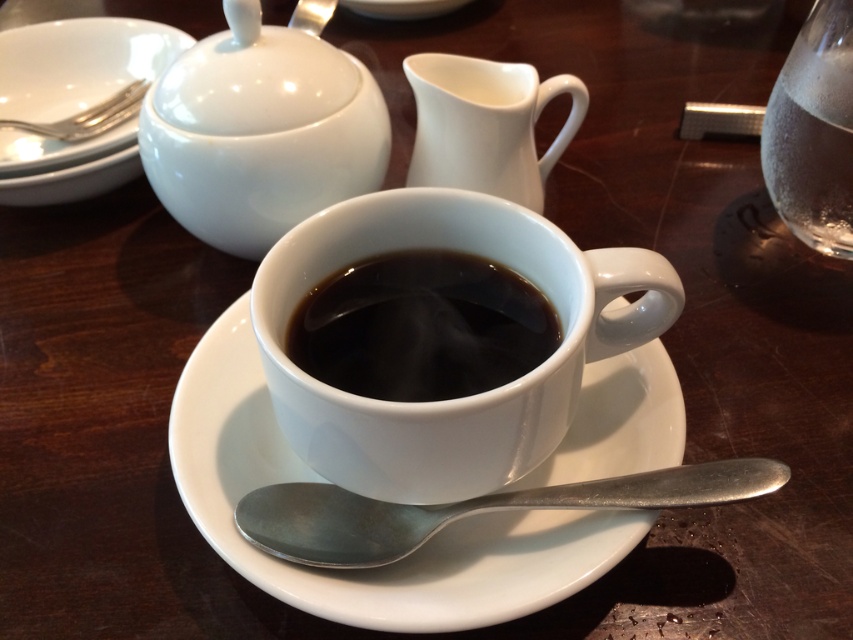
Question: Is silver metallic spoon at lower center below silver metallic fork at upper left?

Choices:
 (A) yes
 (B) no

Answer: (A)

Question: Which point is closer to the camera?

Choices:
 (A) (387, 604)
 (B) (108, 176)
 (C) (219, 36)
 (D) (473, 321)

Answer: (A)

Question: Considering the relative positions of white ceramic saucer at center and white matte saucer at left in the image provided, where is white ceramic saucer at center located with respect to white matte saucer at left?

Choices:
 (A) left
 (B) right

Answer: (B)

Question: Which of the following is the closest to the observer?

Choices:
 (A) silver metallic spoon at lower center
 (B) white ceramic cup at center

Answer: (B)

Question: Among these objects, which one is farthest from the camera?

Choices:
 (A) white glossy creamer at upper center
 (B) silver metallic spoon at lower center
 (C) white ceramic saucer at center

Answer: (A)

Question: Does white glossy sugar bowl at upper left have a lesser width compared to white glossy creamer at upper center?

Choices:
 (A) no
 (B) yes

Answer: (A)